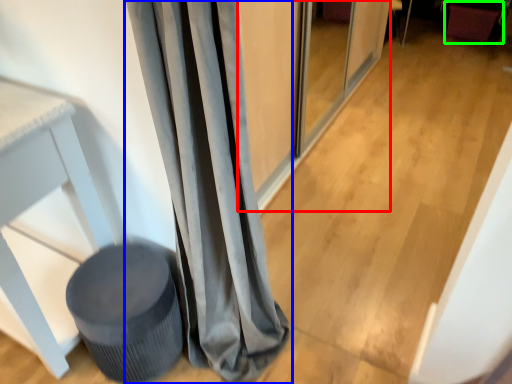
Question: Considering the real-world distances, which object is closest to screen door (highlighted by a red box)? curtain (highlighted by a blue box) or swivel chair (highlighted by a green box).

Choices:
 (A) curtain
 (B) swivel chair

Answer: (A)